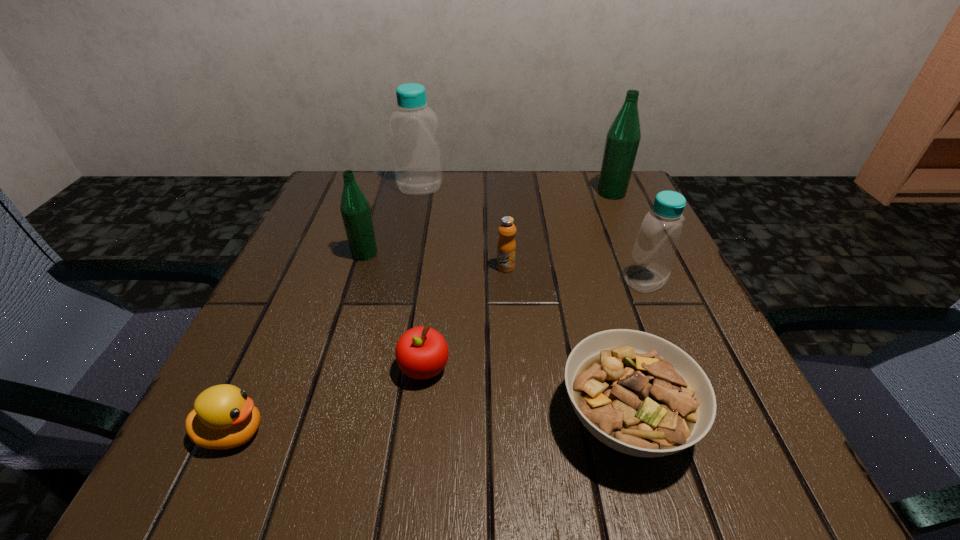
Locate an element on the screen. red apple is located at coordinates (421, 353).

You are a GUI agent. You are given a task and a screenshot of the screen. Output one action in this format:
    pyautogui.click(x=<x>, y=<y>)
    Task: Click on the yellow duckling
    The height and width of the screenshot is (540, 960).
    Given the screenshot: What is the action you would take?
    pyautogui.click(x=224, y=417)

At what (x,y) coordinates should I click in order to perform the action: click on duckling. Please return your answer as a coordinate pair (x, y). Looking at the image, I should click on click(x=224, y=417).

The height and width of the screenshot is (540, 960). I want to click on stew, so click(x=639, y=394).

At what (x,y) coordinates should I click in order to perform the action: click on free space located on the right of the left blue bottle. Please return your answer as a coordinate pair (x, y). Looking at the image, I should click on pyautogui.click(x=540, y=187).

The height and width of the screenshot is (540, 960). Find the location of `free space located 0.360m on the left of the farther green bottle`. free space located 0.360m on the left of the farther green bottle is located at coordinates (447, 193).

Identify the location of vacant space located 0.120m on the front of the right blue bottle. (673, 346).

The image size is (960, 540). Find the location of `free space located on the right of the second nearest bottle`. free space located on the right of the second nearest bottle is located at coordinates (567, 253).

Find the location of a particular element. The image size is (960, 540). vacant area situated 0.090m on the front label of the orange juice is located at coordinates (509, 306).

Image resolution: width=960 pixels, height=540 pixels. I want to click on free spot located 0.050m on the left of the apple, so point(367,368).